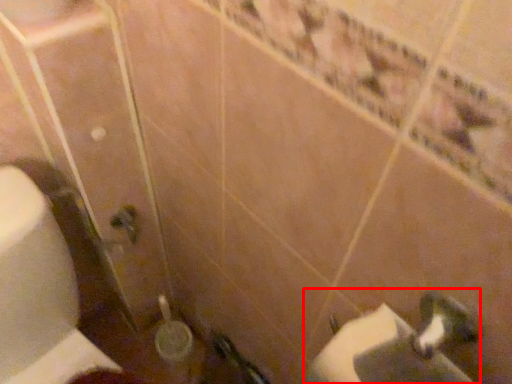
Question: From the image's perspective, what is the correct spatial relationship of sink (annotated by the red box) in relation to toilet paper?

Choices:
 (A) below
 (B) above

Answer: (B)